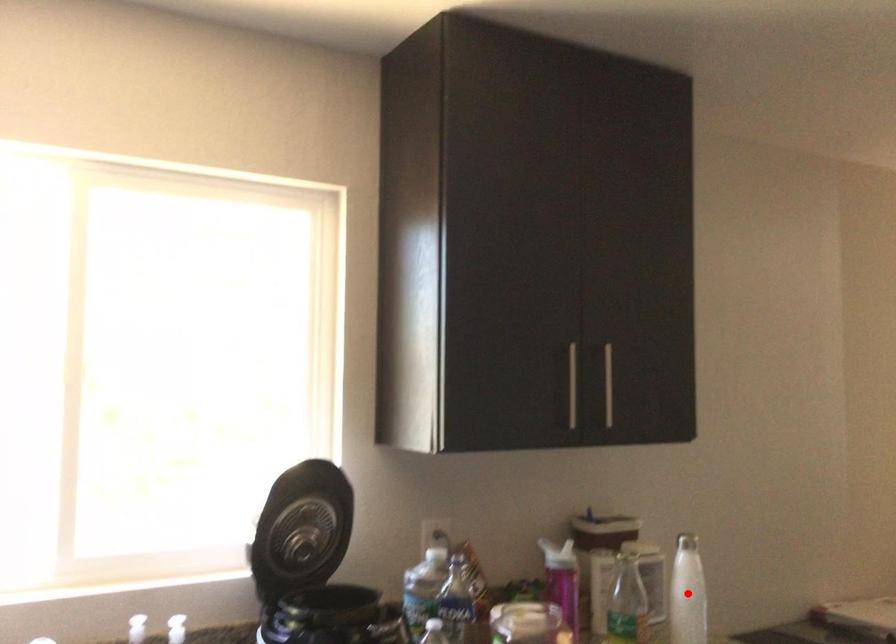
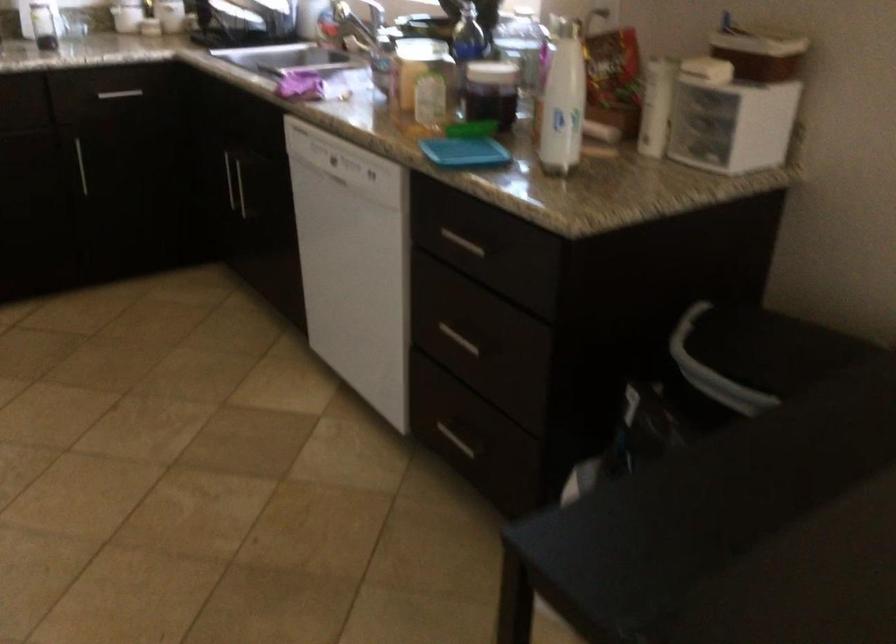
Question: I am providing you with two images of the same scene from different viewpoints. A red point is marked on the first image. At the location where the point appears in image 1, is it still visible in image 2?

Choices:
 (A) Yes
 (B) No

Answer: (B)